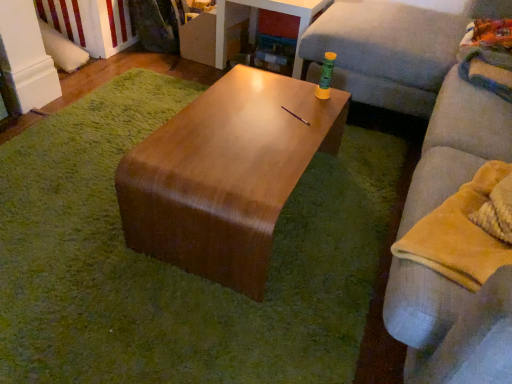
Question: Does wooden table at center come behind yellow fleece blanket at right?

Choices:
 (A) no
 (B) yes

Answer: (B)

Question: From a real-world perspective, is wooden table at center under yellow fleece blanket at right?

Choices:
 (A) no
 (B) yes

Answer: (B)

Question: Is yellow fleece blanket at right located within wooden table at center?

Choices:
 (A) yes
 (B) no

Answer: (B)

Question: Is wooden table at center in front of yellow fleece blanket at right?

Choices:
 (A) yes
 (B) no

Answer: (B)

Question: Does wooden table at center appear on the right side of yellow fleece blanket at right?

Choices:
 (A) no
 (B) yes

Answer: (A)

Question: From the image's perspective, is wooden table at center on yellow fleece blanket at right?

Choices:
 (A) no
 (B) yes

Answer: (B)

Question: Is shiny brown coffee table at center completely or partially outside of wooden table at center?

Choices:
 (A) yes
 (B) no

Answer: (A)

Question: Can you confirm if shiny brown coffee table at center is bigger than wooden table at center?

Choices:
 (A) yes
 (B) no

Answer: (A)

Question: Is shiny brown coffee table at center closer to the viewer compared to wooden table at center?

Choices:
 (A) no
 (B) yes

Answer: (B)

Question: Does shiny brown coffee table at center appear on the left side of wooden table at center?

Choices:
 (A) no
 (B) yes

Answer: (B)

Question: Does shiny brown coffee table at center come behind wooden table at center?

Choices:
 (A) no
 (B) yes

Answer: (A)

Question: Does shiny brown coffee table at center have a greater width compared to wooden table at center?

Choices:
 (A) no
 (B) yes

Answer: (A)

Question: From the image's perspective, is wooden table at center below light gray fabric couch at right?

Choices:
 (A) no
 (B) yes

Answer: (A)